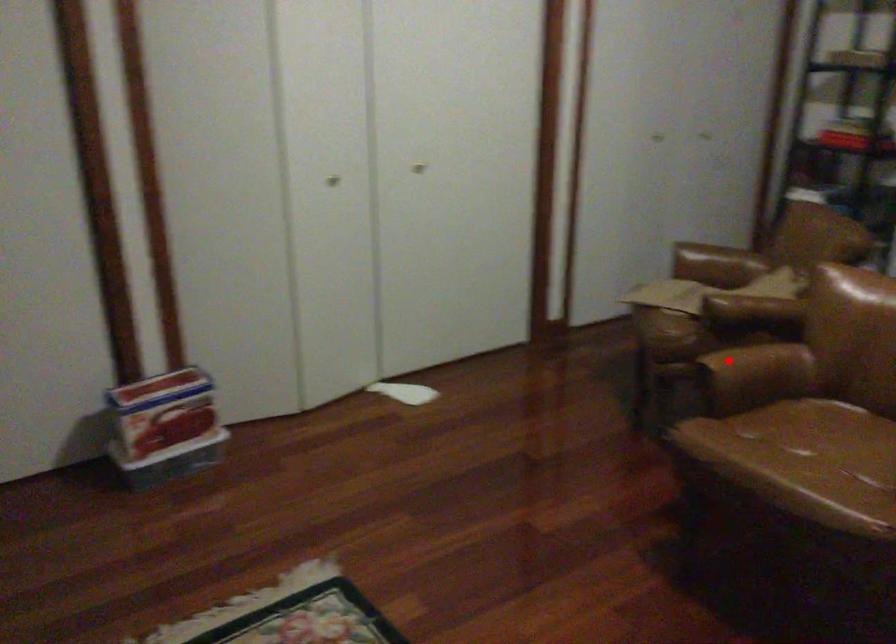
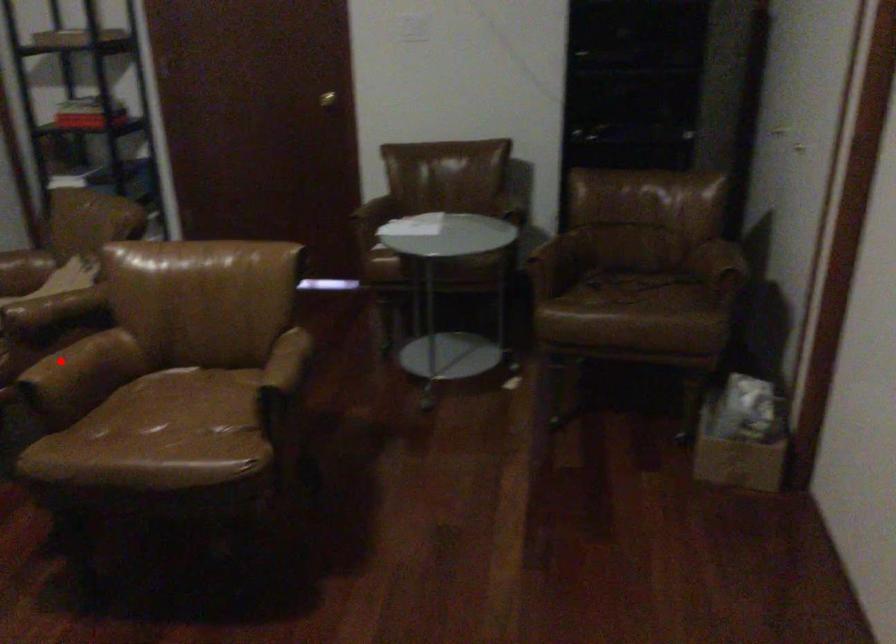
I am providing you with two images of the same scene from different viewpoints. A red point is marked on the first image and another point is marked on the second image. Does the point marked in image1 correspond to the same location as the one in image2?

Yes